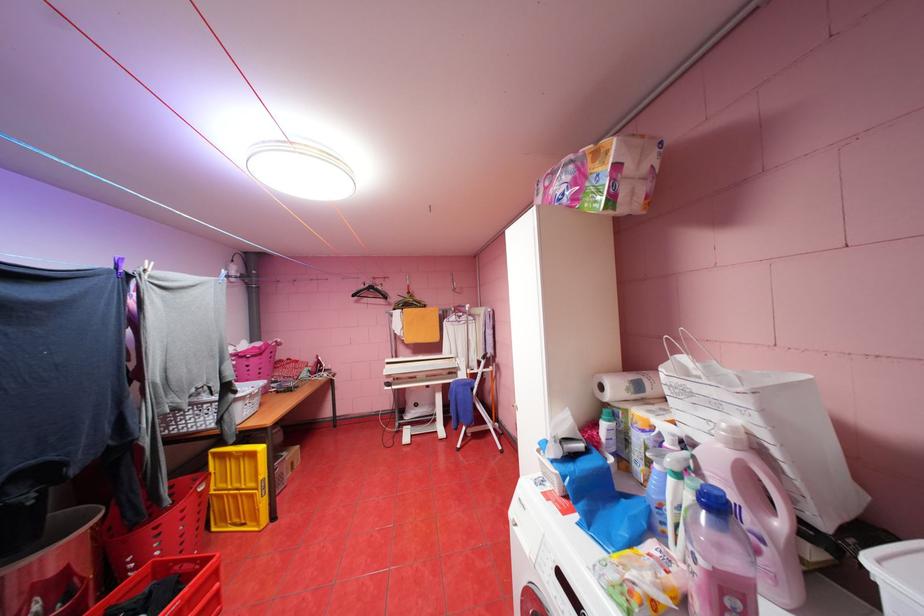
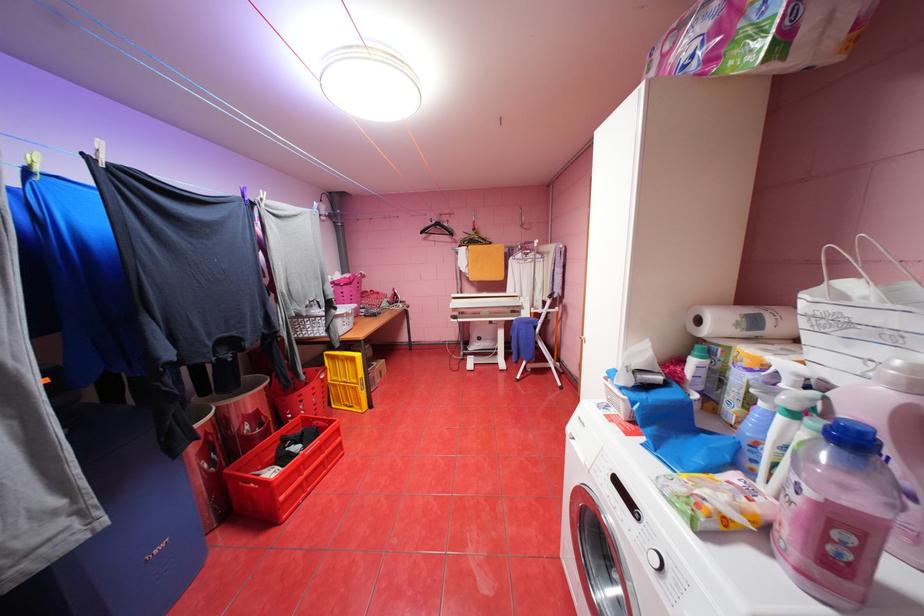
Question: The camera is either moving clockwise (left) or counter-clockwise (right) around the object. The first image is from the beginning of the video and the second image is from the end. Is the camera moving left or right when shooting the video?

Choices:
 (A) Left
 (B) Right

Answer: (B)